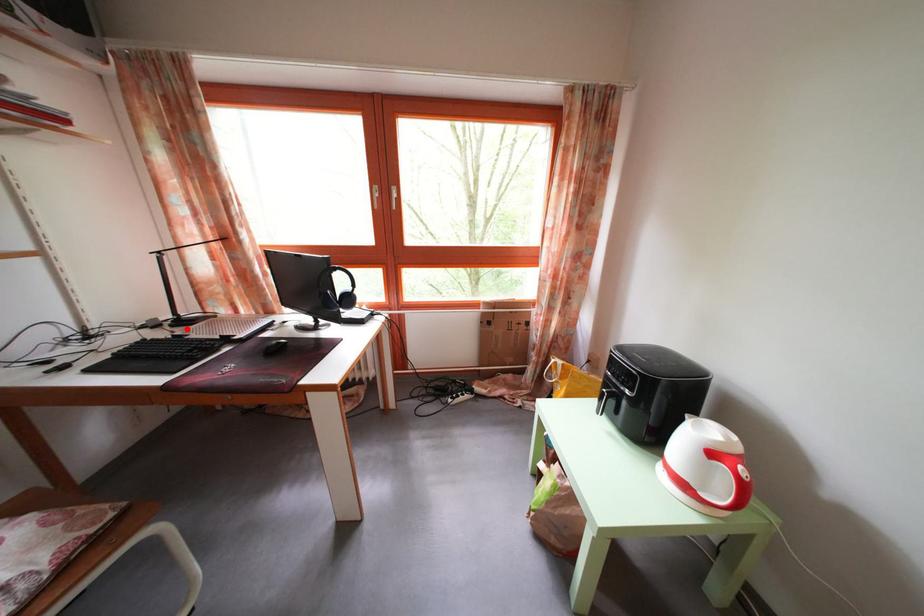
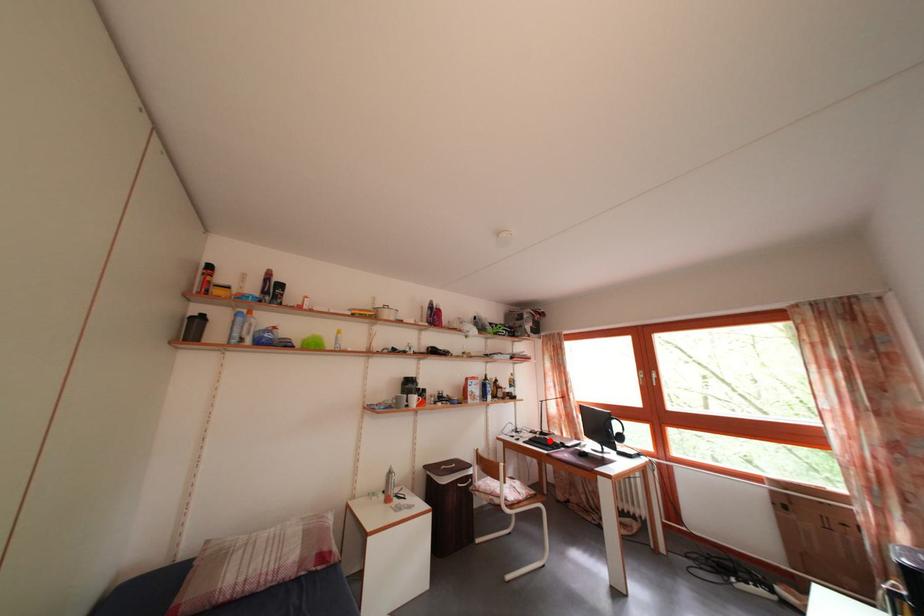
I am providing you with two images of the same scene from different viewpoints. A red point is marked on the first image and another point is marked on the second image. Do the highlighted points in image1 and image2 indicate the same real-world spot?

Yes